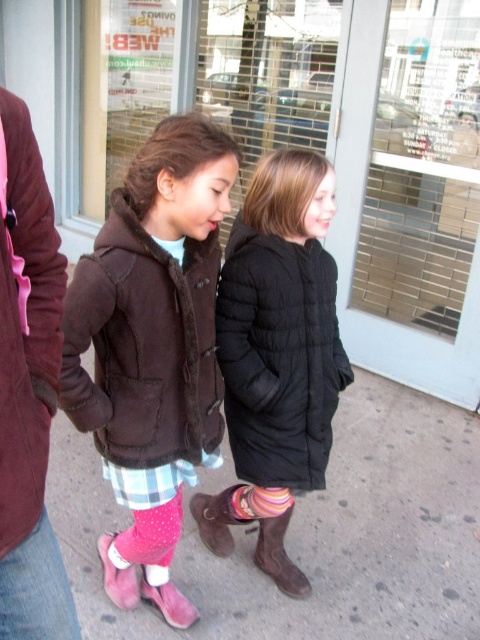
You are a photographer trying to capture a shot of both the pink suede boots at lower center and the maroon fuzzy coat at left. Since you want to frame them together, which object should you position closer to the left side of your camera frame?

The maroon fuzzy coat at left should be positioned closer to the left side of your camera frame because the pink suede boots at lower center is on the right side of it.

You are a photographer trying to capture a photo of the two girls walking on the sidewalk. You want to ensure that both the maroon fuzzy coat at left and the brown suede boot at center are clearly visible in the frame. Based on their positions, which object should you focus on first to ensure both are in the shot?

The maroon fuzzy coat at left is to the left of the brown suede boot at center, so you should focus on the maroon fuzzy coat at left first to ensure both objects are within the frame.